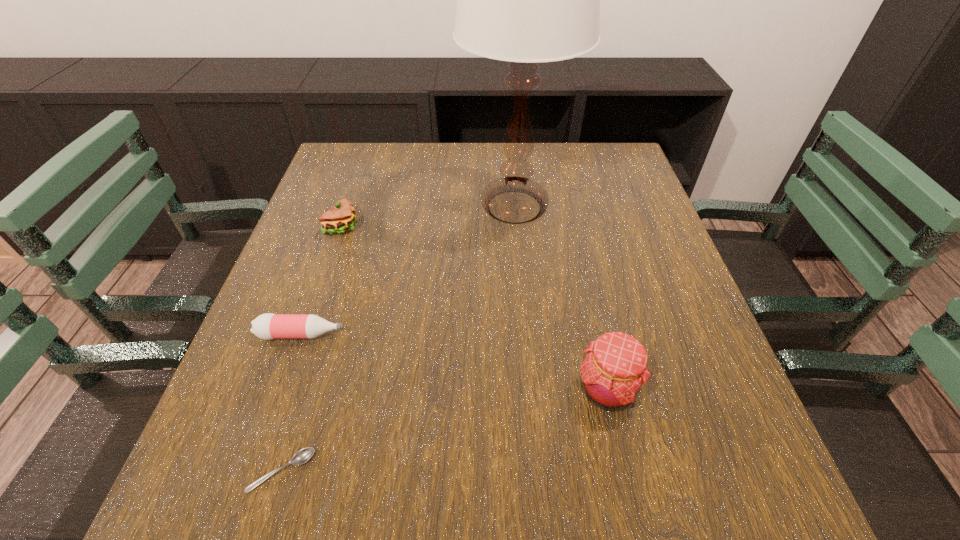
The width and height of the screenshot is (960, 540). I want to click on free spot located on the right of the third tallest object, so click(529, 227).

This screenshot has width=960, height=540. Identify the location of vacant space located with the cap open on the third nearest object. (550, 334).

Identify the location of blank space located on the right of the shortest object. coord(576,471).

At what (x,y) coordinates should I click in order to perform the action: click on object located at the far edge. Please return your answer as a coordinate pair (x, y). The image size is (960, 540). Looking at the image, I should click on [526, 0].

Image resolution: width=960 pixels, height=540 pixels. In order to click on object that is positioned at the near edge in this screenshot , I will do `click(302, 456)`.

You are a GUI agent. You are given a task and a screenshot of the screen. Output one action in this format:
    pyautogui.click(x=<x>, y=<y>)
    Task: Click on the sandwich present at the left edge
    This screenshot has width=960, height=540.
    Given the screenshot: What is the action you would take?
    pyautogui.click(x=339, y=219)

This screenshot has width=960, height=540. I want to click on bottle at the left edge, so click(x=267, y=326).

This screenshot has width=960, height=540. Find the location of `soupspoon positioned at the left edge`. soupspoon positioned at the left edge is located at coordinates (302, 456).

I want to click on object present at the right edge, so click(x=615, y=368).

This screenshot has height=540, width=960. I want to click on object at the near left corner, so click(302, 456).